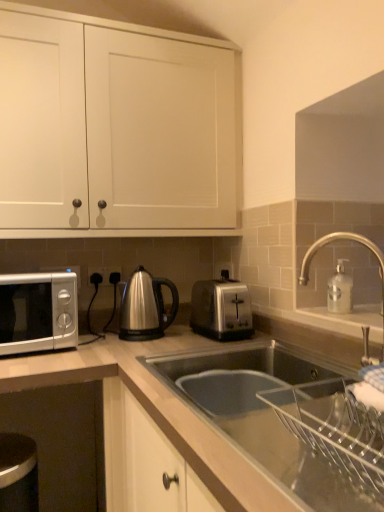
Describe the element at coordinates (38, 312) in the screenshot. The image size is (384, 512). I see `white matte microwave oven at left` at that location.

What is the approximate height of white matte cabinet doors at upper center?

The height of white matte cabinet doors at upper center is 31.99 inches.

Describe the element at coordinates (114, 127) in the screenshot. The image size is (384, 512). I see `white matte cabinet doors at upper center` at that location.

Where is `satin silver toaster at center`? This screenshot has height=512, width=384. satin silver toaster at center is located at coordinates (168, 426).

Does satin silver toaster at center turn towards white matte microwave oven at left?

No, satin silver toaster at center is not oriented towards white matte microwave oven at left.

Looking at their sizes, would you say satin silver toaster at center is wider or thinner than white matte microwave oven at left?

Considering their sizes, satin silver toaster at center looks slimmer than white matte microwave oven at left.

From the image's perspective, which one is positioned lower, satin silver toaster at center or white matte microwave oven at left?

satin silver toaster at center, from the image's perspective.

Between point (222, 284) and point (18, 335), which one is positioned behind?

The point (222, 284) is more distant.

From a real-world perspective, which object stands above the other?

In real-world perspective, stainless steel kettle at center is above.

Which object is further away from the camera, satin silver toaster at center or stainless steel kettle at center?

Positioned behind is stainless steel kettle at center.

Which of these two, satin silver toaster at center or stainless steel kettle at center, is bigger?

With larger size is satin silver toaster at center.

Considering the positions of objects satin silver toaster at center and stainless steel kettle at center in the image provided, who is more to the left, satin silver toaster at center or stainless steel kettle at center?

Positioned to the left is stainless steel kettle at center.

From the image's perspective, between stainless steel kettle at center and satin silver toaster at center, which one is located above?

From the image's view, stainless steel kettle at center is above.

Is stainless steel kettle at center oriented away from satin silver toaster at center?

No, satin silver toaster at center is not at the back of stainless steel kettle at center.

Is stainless steel kettle at center in front of satin silver toaster at center?

No, it is behind satin silver toaster at center.

Is stainless steel kettle at center in contact with satin silver toaster at center?

No, stainless steel kettle at center is not in contact with satin silver toaster at center.

Is satin silver toaster at center shorter than white matte cabinet doors at upper center?

No, satin silver toaster at center is not shorter than white matte cabinet doors at upper center.

From the image's perspective, is satin silver toaster at center located beneath white matte cabinet doors at upper center?

Indeed, from the image's perspective, satin silver toaster at center is shown beneath white matte cabinet doors at upper center.

Is point (91, 357) in front of point (65, 189)?

That is True.

From the image's perspective, is satin silver outlet at center, which is the 1th electric outlet in left-to-right order, located above or below stainless steel kettle at center?

satin silver outlet at center, which is the 1th electric outlet in left-to-right order, is above stainless steel kettle at center.

Considering the sizes of satin silver outlet at center, which is the 1th electric outlet in left-to-right order, and stainless steel kettle at center in the image, is satin silver outlet at center, which is the 1th electric outlet in left-to-right order, bigger or smaller than stainless steel kettle at center?

Considering their sizes, satin silver outlet at center, which is the 1th electric outlet in left-to-right order, takes up less space than stainless steel kettle at center.

Can you confirm if satin silver outlet at center, which is the 1th electric outlet in left-to-right order, is positioned to the left of stainless steel kettle at center?

Yes.

Which is correct: satin silver outlet at center, placed as the second electric outlet when sorted from right to left, is inside stainless steel kettle at center, or outside of it?

satin silver outlet at center, placed as the second electric outlet when sorted from right to left, is located beyond the bounds of stainless steel kettle at center.

Are white matte microwave oven at left and white matte cabinet doors at upper center located far from each other?

white matte microwave oven at left is near white matte cabinet doors at upper center, not far away.

Consider the image. Considering the relative positions of white matte microwave oven at left and white matte cabinet doors at upper center in the image provided, is white matte microwave oven at left to the right of white matte cabinet doors at upper center from the viewer's perspective?

Incorrect, white matte microwave oven at left is not on the right side of white matte cabinet doors at upper center.

From the picture: From their relative heights in the image, would you say white matte microwave oven at left is taller or shorter than white matte cabinet doors at upper center?

Clearly, white matte microwave oven at left is shorter compared to white matte cabinet doors at upper center.

How many degrees apart are the facing directions of satin silver outlet at center, which is the 1th electric outlet in left-to-right order, and white matte microwave oven at left?

satin silver outlet at center, which is the 1th electric outlet in left-to-right order, and white matte microwave oven at left are facing 1.27 degrees away from each other.

Is satin silver outlet at center, placed as the second electric outlet when sorted from right to left, taller than white matte microwave oven at left?

No, satin silver outlet at center, placed as the second electric outlet when sorted from right to left, is not taller than white matte microwave oven at left.

Choose the correct answer: Is satin silver outlet at center, placed as the second electric outlet when sorted from right to left, inside white matte microwave oven at left or outside it?

satin silver outlet at center, placed as the second electric outlet when sorted from right to left, is not inside white matte microwave oven at left, it's outside.

You are a GUI agent. You are given a task and a screenshot of the screen. Output one action in this format:
    pyautogui.click(x=<x>, y=<y>)
    Task: Click on the microwave oven to the left of satin silver toaster at center
    Image resolution: width=384 pixels, height=512 pixels.
    Given the screenshot: What is the action you would take?
    pyautogui.click(x=38, y=312)

The width and height of the screenshot is (384, 512). Find the location of `toaster below the stainless steel kettle at center (from the image's perspective)`. toaster below the stainless steel kettle at center (from the image's perspective) is located at coordinates (221, 309).

Estimate the real-world distances between objects in this image. Which object is closer to white matte cabinet doors at upper center, satin silver outlet at center, which is the 1th electric outlet in right-to-left order, or satin silver toaster at center?

satin silver toaster at center is positioned closer to the anchor white matte cabinet doors at upper center.

Looking at the image, which one is located closer to satin silver outlet at center, placed as the second electric outlet when sorted from right to left, stainless steel kettle at center or white matte microwave oven at left?

stainless steel kettle at center lies closer to satin silver outlet at center, placed as the second electric outlet when sorted from right to left, than the other object.

When comparing their distances from satin silver toaster at center, does satin silver outlet at center, placed as the second electric outlet when sorted from right to left, or stainless steel kettle at center seem closer?

Based on the image, stainless steel kettle at center appears to be nearer to satin silver toaster at center.

Based on the photo, when comparing their distances from satin silver outlet at center, which is the 1th electric outlet in left-to-right order, does satin silver toaster at center or stainless steel kettle at center seem closer?

stainless steel kettle at center.

Considering their positions, is satin silver toaster at center positioned closer to satin silver toaster at center than satin silver outlet at center, which is the 1th electric outlet in left-to-right order?

Among the two, satin silver toaster at center is located nearer to satin silver toaster at center.

In the scene shown: Looking at the image, which one is located further to satin silver outlet at center, which is the second electric outlet in left-to-right order, satin silver toaster at center or white matte microwave oven at left?

satin silver toaster at center.

When comparing their distances from white matte cabinet doors at upper center, does satin silver outlet at center, which is the 1th electric outlet in right-to-left order, or satin silver outlet at center, which is the 1th electric outlet in left-to-right order, seem closer?

Based on the image, satin silver outlet at center, which is the 1th electric outlet in right-to-left order, appears to be nearer to white matte cabinet doors at upper center.

Which object lies nearer to the anchor point stainless steel kettle at center, satin silver outlet at center, which is the second electric outlet in left-to-right order, or satin silver outlet at center, placed as the second electric outlet when sorted from right to left?

satin silver outlet at center, which is the second electric outlet in left-to-right order, is positioned closer to the anchor stainless steel kettle at center.

The image size is (384, 512). What are the coordinates of `electric outlet between stainless steel kettle at center and satin silver outlet at center, which is the 1th electric outlet in right-to-left order, in the front-back direction` in the screenshot? It's located at (96, 275).

Locate an element on the screen. microwave oven between white matte cabinet doors at upper center and satin silver toaster at center vertically is located at coordinates (38, 312).

Image resolution: width=384 pixels, height=512 pixels. What are the coordinates of `tea pot positioned between satin silver toaster at center and satin silver outlet at center, which is the second electric outlet in left-to-right order, from near to far` in the screenshot? It's located at (145, 307).

I want to click on tea pot located between white matte microwave oven at left and satin silver toaster at center in the left-right direction, so click(x=145, y=307).